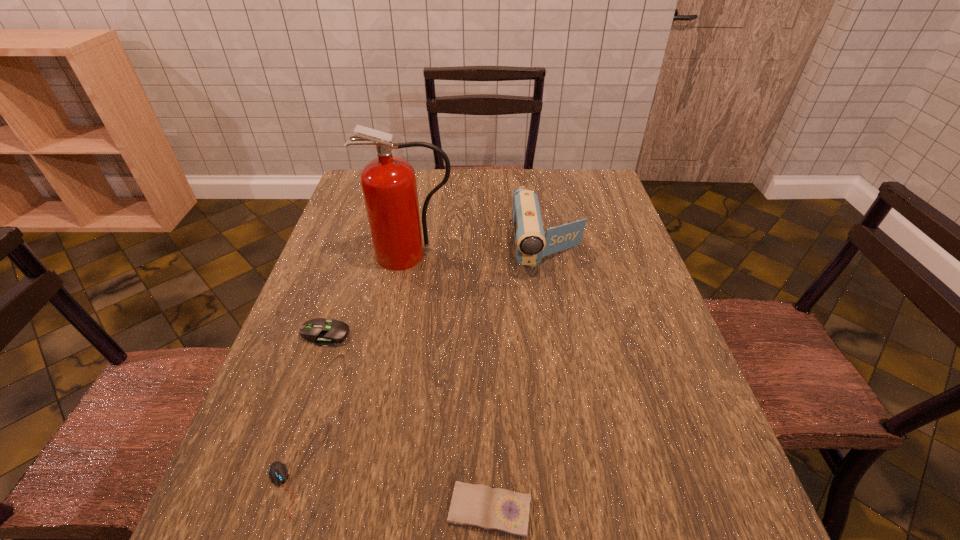
Find the location of a particular element. The height and width of the screenshot is (540, 960). vacant area at the far right corner of the desktop is located at coordinates (604, 191).

Find the location of `free spot between the shorter mouse and the rightmost object`. free spot between the shorter mouse and the rightmost object is located at coordinates [415, 369].

The width and height of the screenshot is (960, 540). I want to click on free space between the diary and the farther mouse, so click(x=408, y=422).

Where is `free spot between the fourth object from left to right and the fire extinguisher`? Image resolution: width=960 pixels, height=540 pixels. free spot between the fourth object from left to right and the fire extinguisher is located at coordinates (450, 382).

Where is `free space between the fourth object from left to right and the camcorder`? The height and width of the screenshot is (540, 960). free space between the fourth object from left to right and the camcorder is located at coordinates (519, 380).

Identify the location of empty space that is in between the second object from right to left and the third shortest object. The image size is (960, 540). (408, 422).

Locate an element on the screen. free space between the rightmost object and the diary is located at coordinates (519, 380).

The width and height of the screenshot is (960, 540). Find the location of `vacant space that is in between the second tallest object and the third farthest object`. vacant space that is in between the second tallest object and the third farthest object is located at coordinates (437, 292).

The height and width of the screenshot is (540, 960). In order to click on free area in between the farther mouse and the rightmost object in this screenshot , I will do `click(437, 292)`.

Find the location of `free space between the tallest object and the nearer mouse`. free space between the tallest object and the nearer mouse is located at coordinates (347, 372).